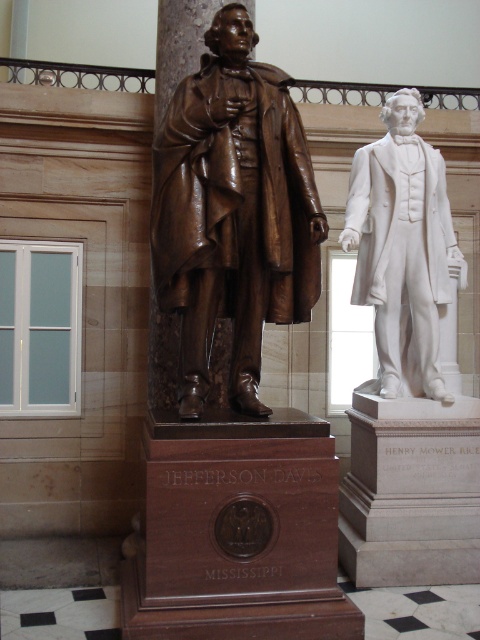
You are a tour guide leading a group through a historical building. You need to ensure that visitors maintain a safe distance of at least 5 feet between themselves and each statue for preservation purposes. Given the spacing between the bronze statue at center and the white marble statue at right, is the current distance between the statues sufficient to allow visitors to stand between them while adhering to the 5 feet rule?

The bronze statue at center and the white marble statue at right are 4.25 feet apart from each other. Since the required safe distance is 5 feet, the current spacing is insufficient. Visitors cannot stand between them while maintaining the 5 feet rule.

You are standing in the room with the two statues and want to take a photo of both statues. You notice two points marked on the floor at coordinates point (279, 317) and point (408, 225). Which point should you stand at to ensure both statues are fully visible in your camera frame?

You should stand at point (408, 225) because it is behind point (279, 317), allowing you to see both statues without obstruction.

In the scene shown: You are an art conservator assessing the placement of the bronze statue at center and the white marble statue at right. Based on their current positions, which statue is placed higher in elevation?

The bronze statue at center is positioned over the white marble statue at right, meaning it is placed higher in elevation.